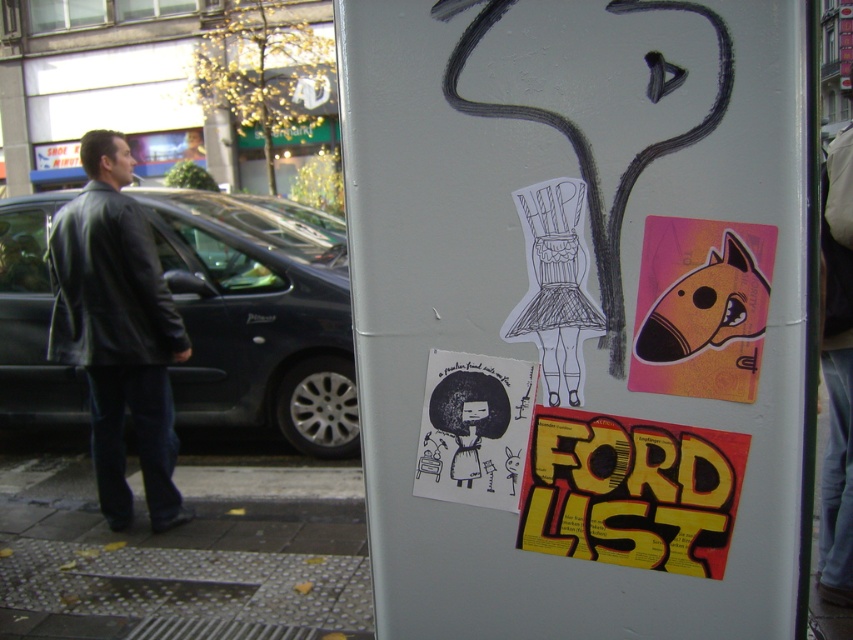
Consider the image. Is yellow paper poster at center in front of shiny orange sticker at upper right?

No, it is not.

Can you confirm if yellow paper poster at center is shorter than shiny orange sticker at upper right?

Indeed, yellow paper poster at center has a lesser height compared to shiny orange sticker at upper right.

Image resolution: width=853 pixels, height=640 pixels. What are the coordinates of `yellow paper poster at center` in the screenshot? It's located at (630, 492).

Between yellow paper poster at center and black paper poster at center, which one appears on the right side from the viewer's perspective?

yellow paper poster at center is more to the right.

Which is above, yellow paper poster at center or black paper poster at center?

black paper poster at center

Is point (544, 474) more distant than point (440, 436)?

No, (544, 474) is closer to viewer.

Locate an element on the screen. yellow paper poster at center is located at coordinates (630, 492).

Describe the element at coordinates (117, 330) in the screenshot. The image size is (853, 640). I see `black leather jacket at left` at that location.

Which of these two, black leather jacket at left or yellow paper poster at center, stands shorter?

yellow paper poster at center

Which is in front, point (137, 362) or point (680, 540)?

Positioned in front is point (680, 540).

The width and height of the screenshot is (853, 640). Identify the location of black leather jacket at left. (117, 330).